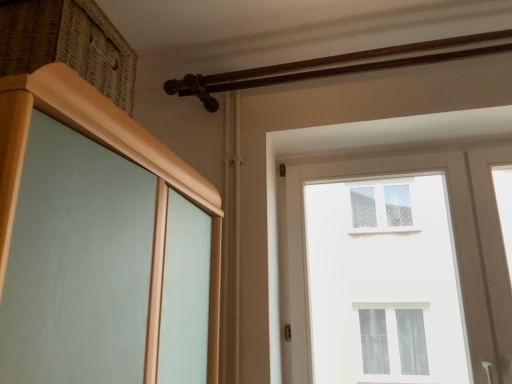
Question: Is woven wood drawer at upper left at the right side of white glass window at upper center?

Choices:
 (A) no
 (B) yes

Answer: (A)

Question: Is woven wood drawer at upper left behind white glass window at upper center?

Choices:
 (A) yes
 (B) no

Answer: (B)

Question: Is woven wood drawer at upper left directly adjacent to white glass window at upper center?

Choices:
 (A) no
 (B) yes

Answer: (A)

Question: Considering the relative sizes of woven wood drawer at upper left and white glass window at upper center in the image provided, is woven wood drawer at upper left taller than white glass window at upper center?

Choices:
 (A) no
 (B) yes

Answer: (A)

Question: Considering the relative sizes of woven wood drawer at upper left and white glass window at upper center in the image provided, is woven wood drawer at upper left thinner than white glass window at upper center?

Choices:
 (A) no
 (B) yes

Answer: (A)

Question: From a real-world perspective, is woven wood drawer at upper left under white glass window at upper center?

Choices:
 (A) no
 (B) yes

Answer: (A)

Question: Are brown wooden rail at upper center and woven wood drawer at upper left located far from each other?

Choices:
 (A) yes
 (B) no

Answer: (B)

Question: Is brown wooden rail at upper center positioned beyond the bounds of woven wood drawer at upper left?

Choices:
 (A) no
 (B) yes

Answer: (B)

Question: Is woven wood drawer at upper left at the back of brown wooden rail at upper center?

Choices:
 (A) yes
 (B) no

Answer: (B)

Question: Does brown wooden rail at upper center have a lesser width compared to woven wood drawer at upper left?

Choices:
 (A) no
 (B) yes

Answer: (A)

Question: Is brown wooden rail at upper center at the left side of woven wood drawer at upper left?

Choices:
 (A) no
 (B) yes

Answer: (A)

Question: Does brown wooden rail at upper center have a smaller size compared to woven wood drawer at upper left?

Choices:
 (A) yes
 (B) no

Answer: (B)

Question: Is woven wood drawer at upper left thinner than brown wooden rail at upper center?

Choices:
 (A) yes
 (B) no

Answer: (A)